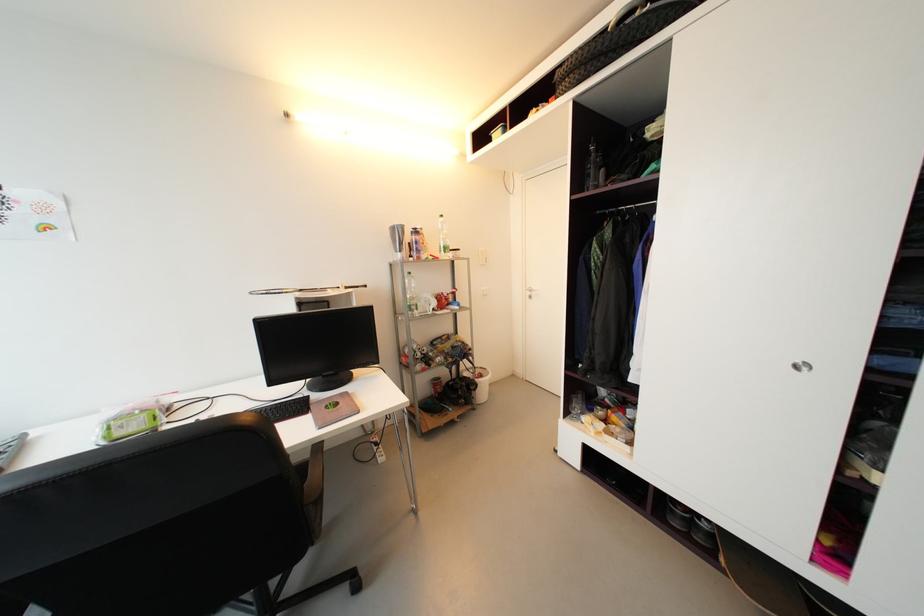
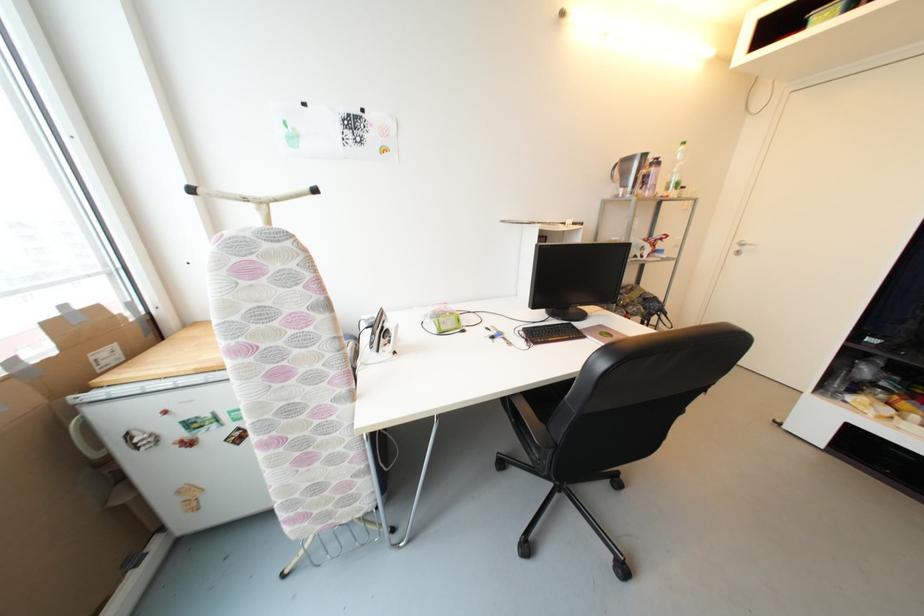
The point at (399, 244) is marked in the first image. Where is the corresponding point in the second image?

(629, 177)